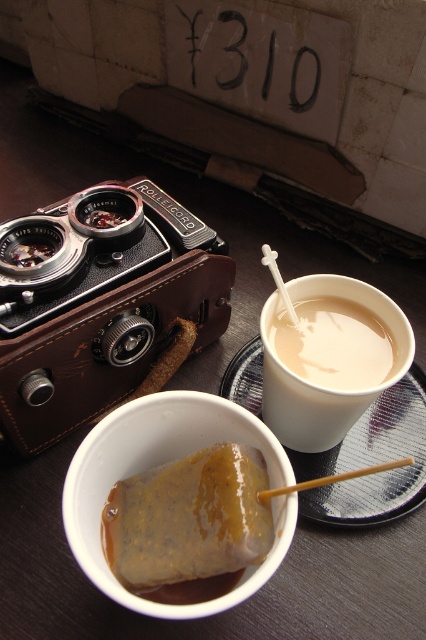
Question: Estimate the real-world distances between objects in this image. Which object is closer to the brown wooden chopstick at upper center?

Choices:
 (A) white matte cup at upper right
 (B) brown matte pastry at lower left
 (C) matte black camera at upper left
 (D) matte plastic cup at upper right

Answer: (B)

Question: Does white matte cup at upper right appear over matte plastic cup at upper right?

Choices:
 (A) yes
 (B) no

Answer: (B)

Question: Considering the relative positions of matte plastic cup at upper right and brown wooden chopstick at upper center in the image provided, where is matte plastic cup at upper right located with respect to brown wooden chopstick at upper center?

Choices:
 (A) left
 (B) right

Answer: (A)

Question: Estimate the real-world distances between objects in this image. Which object is farther from the matte black camera at upper left?

Choices:
 (A) white matte cup at upper right
 (B) matte plastic cup at upper right
 (C) brown wooden chopstick at upper center

Answer: (C)

Question: Which point is closer to the camera?

Choices:
 (A) (351, 346)
 (B) (114, 330)
 (C) (319, 296)
 (D) (268, 522)

Answer: (D)

Question: Does matte black camera at upper left have a larger size compared to white matte cup at upper right?

Choices:
 (A) yes
 (B) no

Answer: (A)